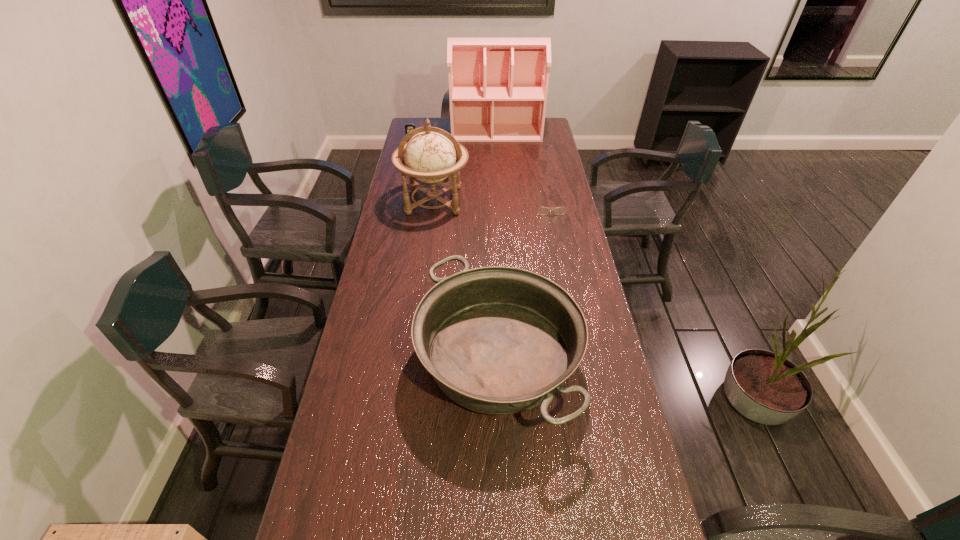
I want to click on dollhouse, so click(x=498, y=87).

The width and height of the screenshot is (960, 540). I want to click on the tallest object, so click(x=498, y=87).

Identify the location of globe. This screenshot has width=960, height=540. (432, 156).

You are a GUI agent. You are given a task and a screenshot of the screen. Output one action in this format:
    pyautogui.click(x=<x>, y=<y>)
    Task: Click on the nearest object
    
    Given the screenshot: What is the action you would take?
    coord(497,340)

You are a GUI agent. You are given a task and a screenshot of the screen. Output one action in this format:
    pyautogui.click(x=<x>, y=<y>)
    Task: Click on the pan
    The image size is (960, 540).
    Given the screenshot: What is the action you would take?
    pyautogui.click(x=497, y=340)

Identify the location of the second farthest object. This screenshot has width=960, height=540. (408, 127).

The image size is (960, 540). In order to click on cellular telephone in this screenshot , I will do `click(408, 127)`.

Where is `the shortest object`? The height and width of the screenshot is (540, 960). the shortest object is located at coordinates (541, 210).

Image resolution: width=960 pixels, height=540 pixels. In order to click on free space located 0.320m on the front-facing side of the tallest object in this screenshot , I will do `click(499, 176)`.

Locate an element on the screen. vacant space situated at the front of the fourth shortest object showing Africa is located at coordinates (427, 253).